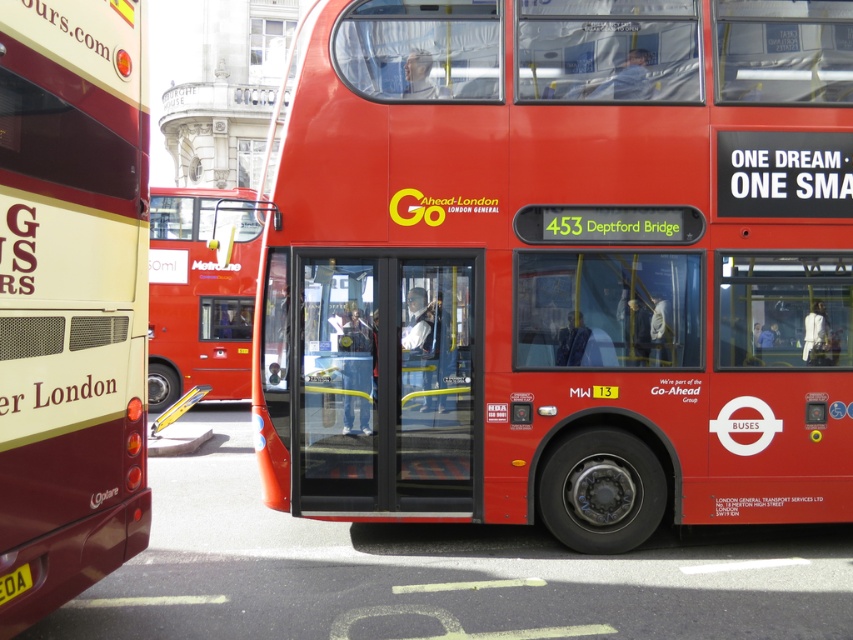
Consider the image. You are a pedestrian standing at the crosswalk and see the shiny red bus at center and the yellow plastic license plate at lower left. Which object is closer to you?

The shiny red bus at center is closer to you than the yellow plastic license plate at lower left because the license plate is positioned behind the bus.